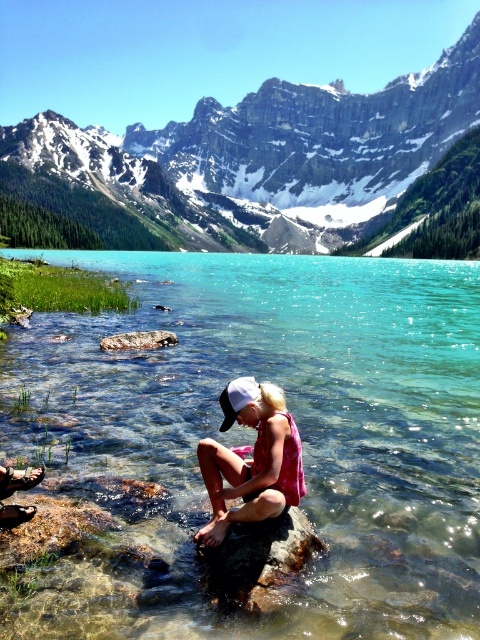
You are standing at the edge of the lake and want to step onto the smooth gray rock at lower left. Based on the scene, is the clear glassy water at center between you and the rock?

Yes, the clear glassy water at center is between you and the smooth gray rock at lower left because the water is located above the rock, meaning it lies in the path towards the rock from your position at the edge.

You are a hiker who wants to cross from the smooth gray rock at lower left to the clear glassy water at center. Given that your backpack weighs 15 kilograms, can you safely make this journey?

The distance between the clear glassy water at center and the smooth gray rock at lower left is 50.63 meters. Since the backpack weighs 15 kilograms, the hiker can safely traverse the 50.63 meters distance as there is no indication of obstacles or physical limitations mentioned in the scene description.

You are a photographer trying to capture the pink fabric at center and the smooth gray rock at lower left in the same frame. Based on their positions, which object will appear closer to the camera in the photo?

The pink fabric at center appears closer to the camera than the smooth gray rock at lower left because it is positioned in front of it.